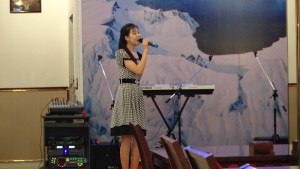
The image size is (300, 169). In order to click on tan wall in this screenshot , I will do `click(38, 55)`.